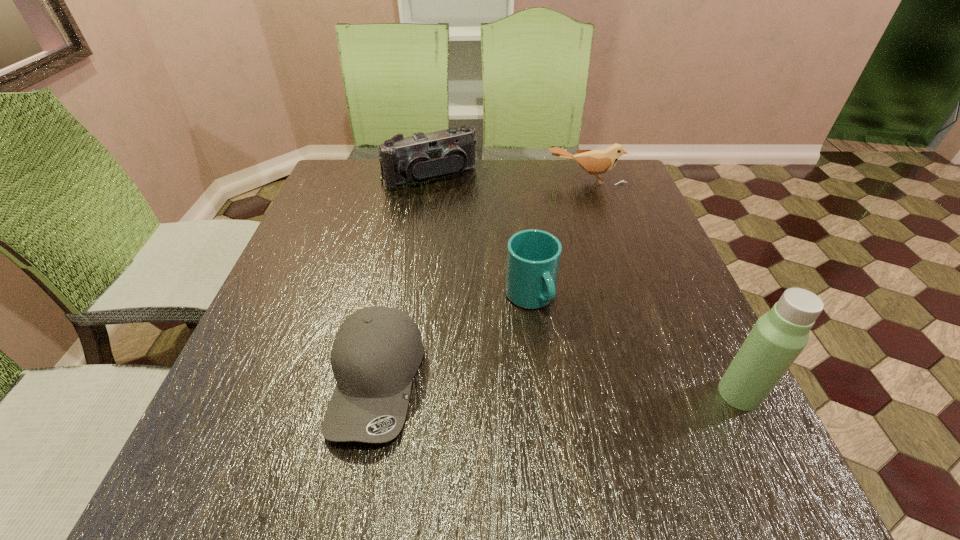
This screenshot has width=960, height=540. I want to click on object present at the left edge, so click(420, 157).

Locate an element on the screen. This screenshot has height=540, width=960. thermos bottle at the right edge is located at coordinates (778, 337).

The image size is (960, 540). Find the location of `bird at the right edge`. bird at the right edge is located at coordinates (595, 162).

Where is `object that is at the far left corner`? The width and height of the screenshot is (960, 540). object that is at the far left corner is located at coordinates (420, 157).

You are a GUI agent. You are given a task and a screenshot of the screen. Output one action in this format:
    pyautogui.click(x=<x>, y=<y>)
    Task: Click on the object located at the far right corner
    The height and width of the screenshot is (540, 960).
    Given the screenshot: What is the action you would take?
    pyautogui.click(x=595, y=162)

You are a GUI agent. You are given a task and a screenshot of the screen. Output one action in this format:
    pyautogui.click(x=<x>, y=<y>)
    Task: Click on the object that is at the near right corner
    Image resolution: width=960 pixels, height=540 pixels.
    Given the screenshot: What is the action you would take?
    pyautogui.click(x=778, y=337)

In the image, there is a desktop. At what (x,y) coordinates should I click in order to perform the action: click on vacant space at the far edge. Please return your answer as a coordinate pair (x, y). The width and height of the screenshot is (960, 540). Looking at the image, I should click on (440, 180).

At what (x,y) coordinates should I click in order to perform the action: click on vacant region at the near edge of the desktop. Please return your answer as a coordinate pair (x, y). The image size is (960, 540). Looking at the image, I should click on (477, 432).

Locate an element on the screen. vacant space at the left edge is located at coordinates (337, 258).

At what (x,y) coordinates should I click in order to perform the action: click on vacant space at the right edge. Please return your answer as a coordinate pair (x, y). Image resolution: width=960 pixels, height=540 pixels. Looking at the image, I should click on (688, 354).